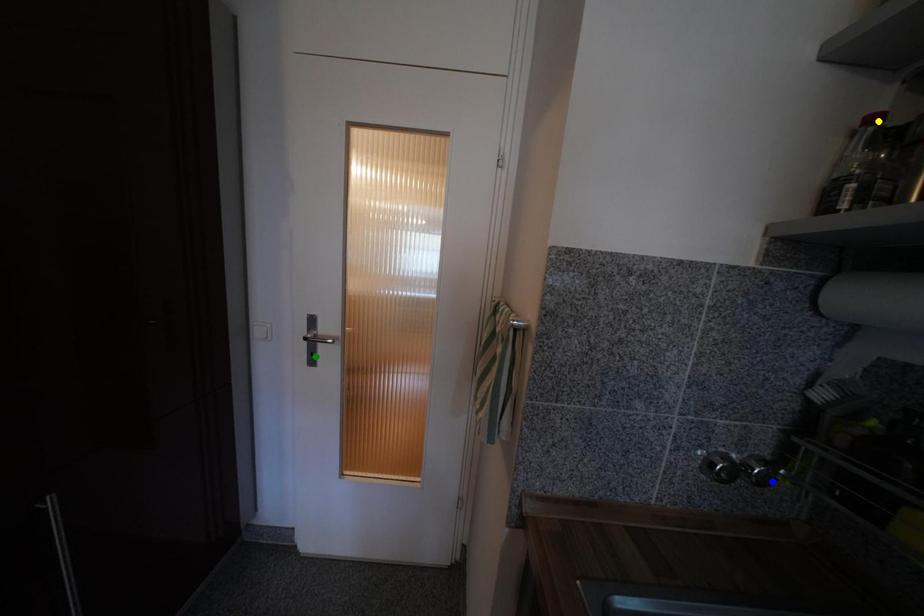
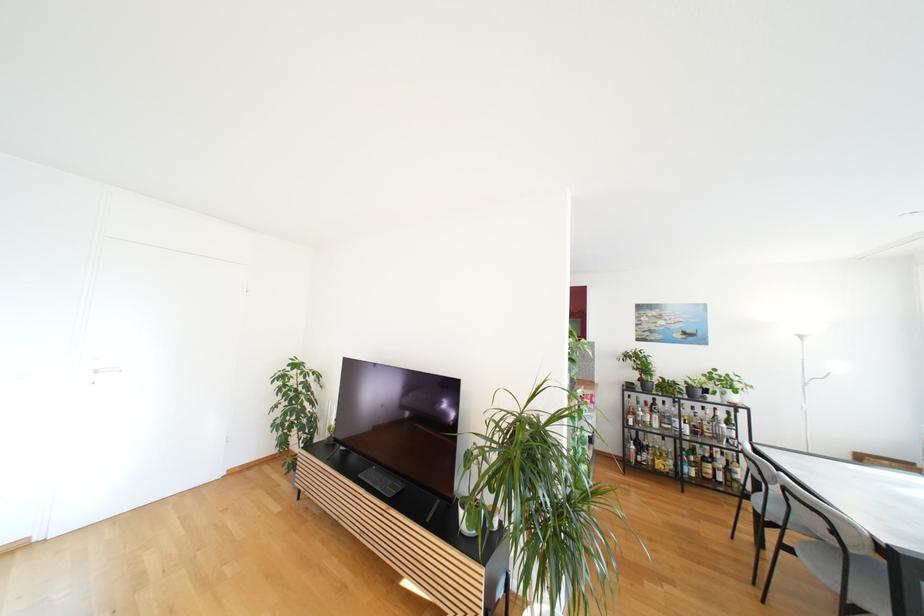
I am providing you with two images of the same scene from different viewpoints. Three points are marked in image1. Which point corresponds to a part or object that is occluded in image2?In image1, three points are marked. Which of them correspond to a part or object that is occluded in image2?Among the three points shown in image1, which one corresponds to a part or object that is no longer visible due to occlusion in image2?

blue point, green point, yellow point